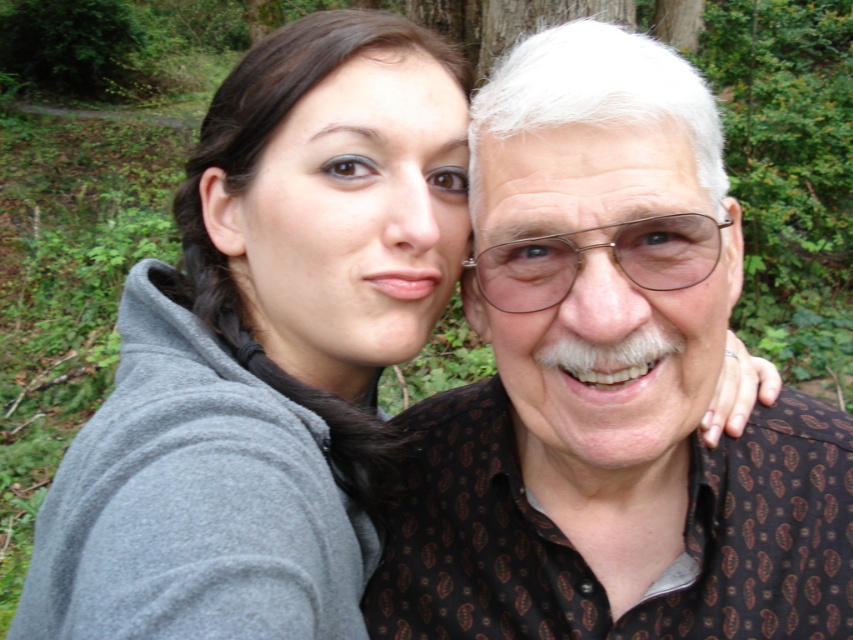
Question: Which point is closer to the camera taking this photo?

Choices:
 (A) (723, 236)
 (B) (631, 256)

Answer: (B)

Question: Which point is closer to the camera taking this photo?

Choices:
 (A) (648, 280)
 (B) (614, 260)
 (C) (434, 48)

Answer: (B)

Question: Does brown patterned shirt at center have a larger size compared to metallic wireframe glasses at center?

Choices:
 (A) yes
 (B) no

Answer: (A)

Question: Does brown patterned shirt at center have a smaller size compared to gray fleece jacket at upper left?

Choices:
 (A) yes
 (B) no

Answer: (A)

Question: Considering the relative positions of brown patterned shirt at center and metallic wireframe glasses at center in the image provided, where is brown patterned shirt at center located with respect to metallic wireframe glasses at center?

Choices:
 (A) above
 (B) below

Answer: (B)

Question: Which is nearer to the metallic wireframe glasses at center?

Choices:
 (A) gray fleece jacket at upper left
 (B) brown patterned shirt at center

Answer: (B)